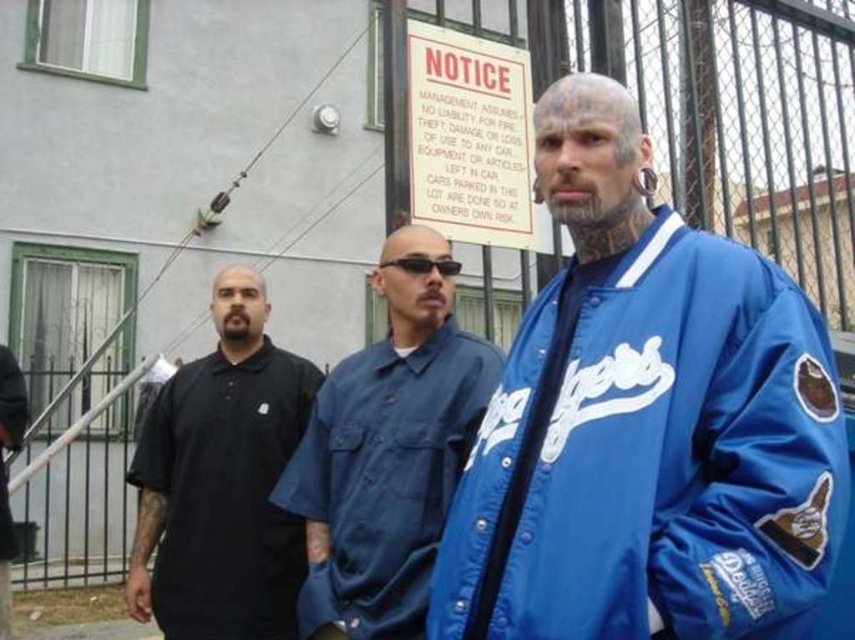
You are standing at the point marked by the coordinate point at (438, 493). You want to walk towards the security camera mounted on the wall near the top left corner. Is the security camera in your line of sight? Please explain your reasoning.

The security camera is mounted on the wall near the top left corner, and you are at the point marked by the coordinate point at (438, 493). Since the individuals are 3.82 meters apart, the security camera should be visible in your line of sight unless there are obstructions like people or objects blocking the path. However, the description does not mention any obstructions, so it is likely visible.

You are standing in front of the building and want to place a small flag at point (x=567, y=285) and another flag at point (x=264, y=348). Which flag will be closer to your eyes?

The flag placed at point (x=567, y=285) will be closer to your eyes because it is closer to the viewer than point (x=264, y=348).